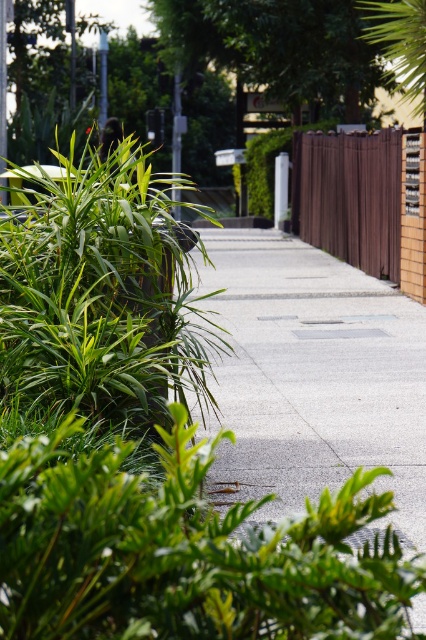
Question: Is brown wooden fence at right bigger than green leafy tree at upper right?

Choices:
 (A) no
 (B) yes

Answer: (A)

Question: Which of these objects is positioned farthest from the green leafy tree at upper right?

Choices:
 (A) concrete sidewalk at center
 (B) brown wooden fence at right

Answer: (A)

Question: Which object appears farthest from the camera in this image?

Choices:
 (A) green leafy tree at upper right
 (B) concrete sidewalk at center

Answer: (A)

Question: Where is green leafy bush at left located in relation to green leafy tree at upper right in the image?

Choices:
 (A) below
 (B) above

Answer: (A)

Question: Considering the relative positions of concrete sidewalk at center and brown wooden fence at right in the image provided, where is concrete sidewalk at center located with respect to brown wooden fence at right?

Choices:
 (A) below
 (B) above

Answer: (A)

Question: Which point appears farthest from the camera in this image?

Choices:
 (A) (178, 342)
 (B) (379, 209)
 (C) (377, 310)
 (D) (393, 45)

Answer: (B)